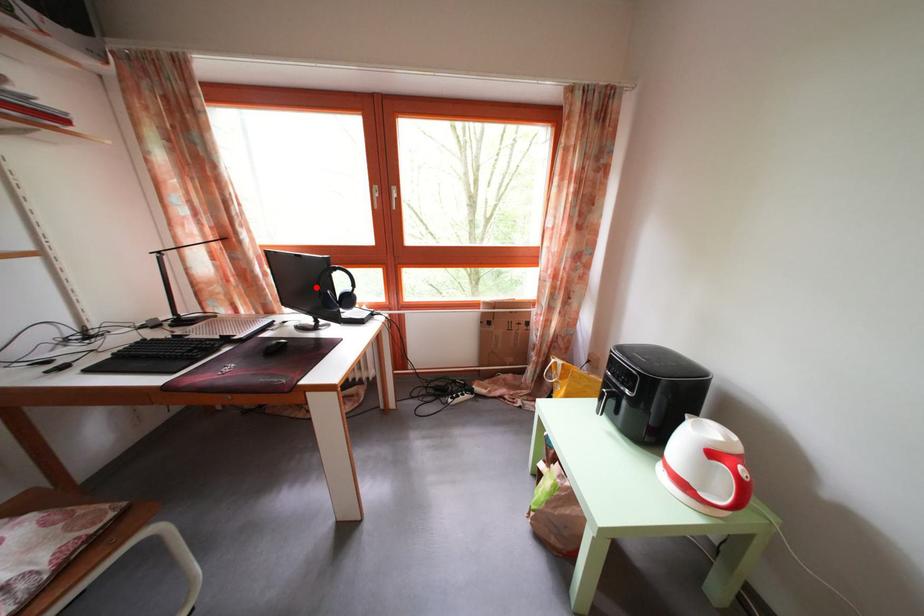
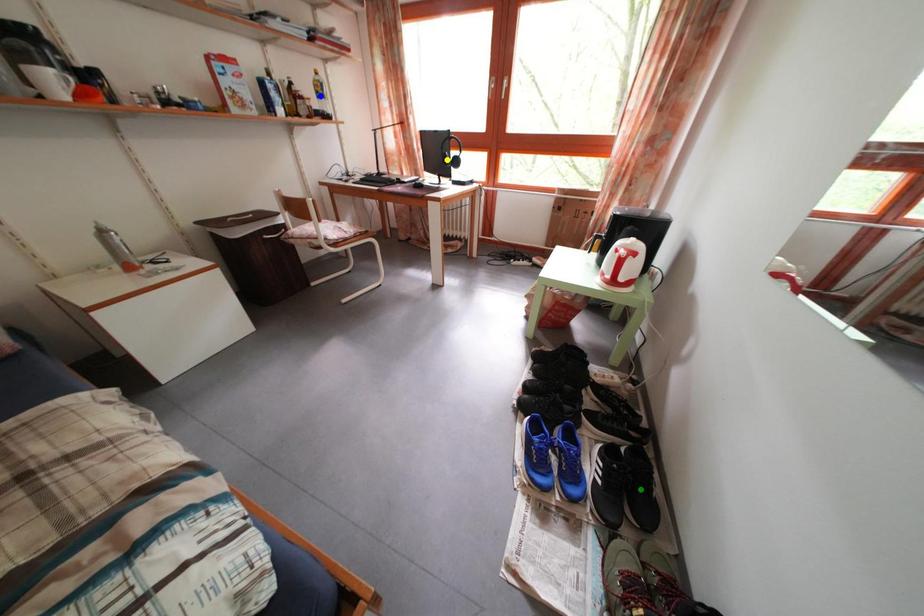
Question: I am providing you with two images of the same scene from different viewpoints. A red point is marked on the first image. You are given multiple points on the second image. Which point in image 2 represents the same 3d spot as the red point in image 1?

Choices:
 (A) blue point
 (B) yellow point
 (C) green point

Answer: (B)